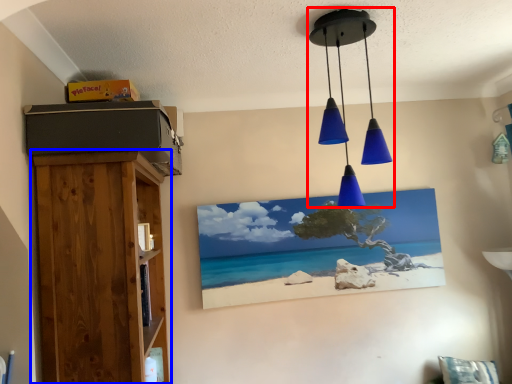
Question: Which object appears farthest to the camera in this image, lamp (highlighted by a red box) or furniture (highlighted by a blue box)?

Choices:
 (A) lamp
 (B) furniture

Answer: (A)